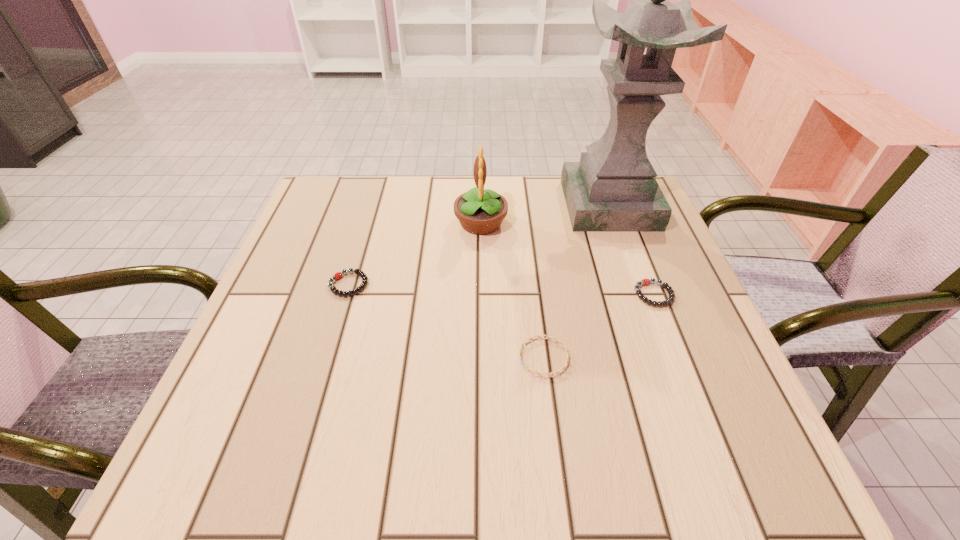
Point out which bracelet is positioned as the second nearest to the leftmost bracelet. Please provide its 2D coordinates. Your answer should be formatted as a tuple, i.e. [(x, y)], where the tuple contains the x and y coordinates of a point satisfying the conditions above.

[(645, 281)]

Where is `bracelet that stands as the second closest to the rightmost bracelet`? This screenshot has width=960, height=540. bracelet that stands as the second closest to the rightmost bracelet is located at coordinates (338, 275).

This screenshot has height=540, width=960. I want to click on vacant space that satisfies the following two spatial constraints: 1. at the front opening of the rightmost bracelet; 2. on the right side of the sculpture, so click(642, 294).

Identify the location of vacant region that satisfies the following two spatial constraints: 1. at the front opening of the tallest object; 2. on the surface of the nearest object showing star-shaped elements. Image resolution: width=960 pixels, height=540 pixels. (665, 357).

This screenshot has height=540, width=960. What are the coordinates of `free space that satisfies the following two spatial constraints: 1. on the face of the rightmost bracelet; 2. on the right side of the second tallest object` in the screenshot? It's located at (481, 294).

Where is `vacant point that satisfies the following two spatial constraints: 1. at the front opening of the sculpture; 2. on the left side of the rightmost bracelet`? The width and height of the screenshot is (960, 540). vacant point that satisfies the following two spatial constraints: 1. at the front opening of the sculpture; 2. on the left side of the rightmost bracelet is located at coordinates (642, 294).

Locate an element on the screen. vacant region that satisfies the following two spatial constraints: 1. at the front opening of the tallest object; 2. on the face of the sunflower is located at coordinates (615, 222).

At what (x,y) coordinates should I click in order to perform the action: click on vacant space that satisfies the following two spatial constraints: 1. on the face of the fourth shortest object; 2. on the back side of the rightmost bracelet. Please return your answer as a coordinate pair (x, y). This screenshot has height=540, width=960. Looking at the image, I should click on (481, 294).

This screenshot has width=960, height=540. I want to click on free point that satisfies the following two spatial constraints: 1. at the front opening of the sculpture; 2. on the right side of the rightmost bracelet, so click(642, 294).

The image size is (960, 540). Identify the location of free space that satisfies the following two spatial constraints: 1. at the front opening of the tallest object; 2. on the right side of the rightmost bracelet. (642, 294).